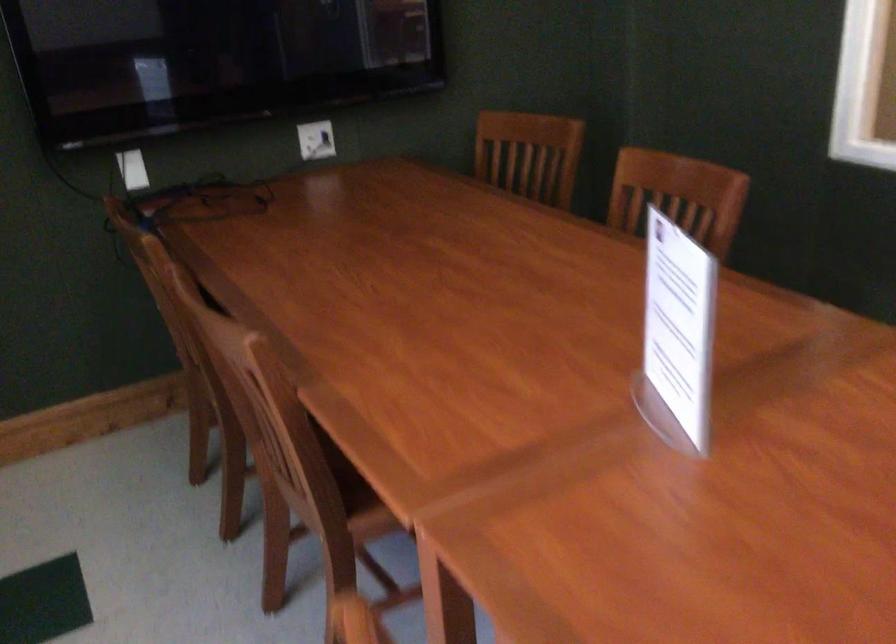
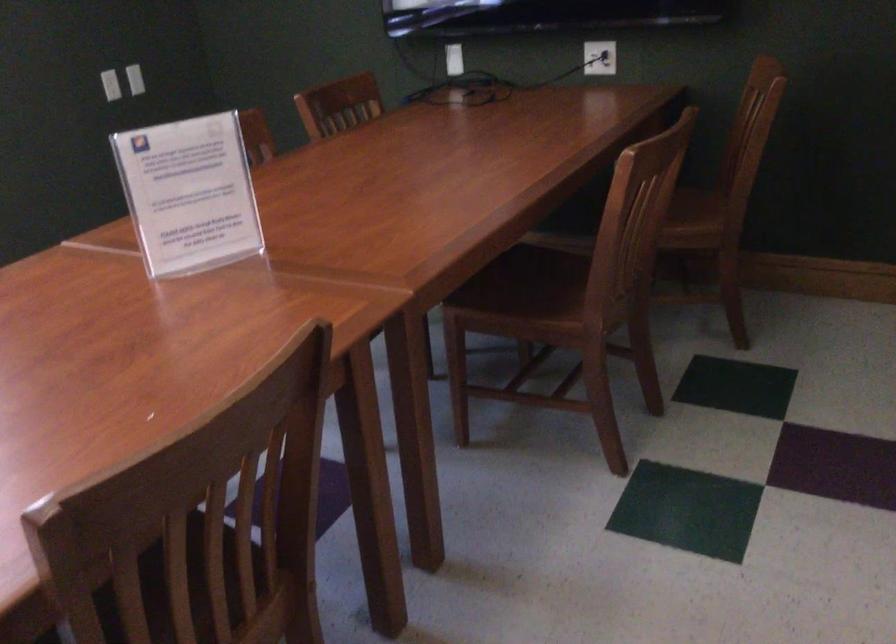
Locate, in the second image, the point that corresponds to (334,136) in the first image.

(599, 58)